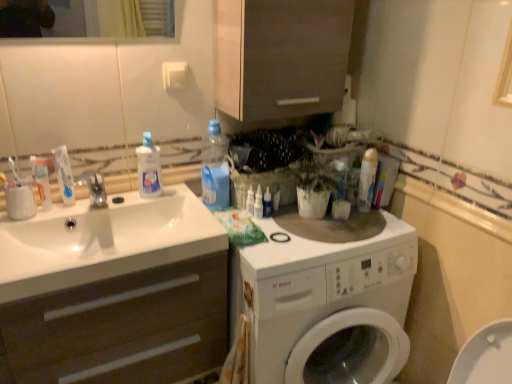
This screenshot has height=384, width=512. I want to click on vacant area located to the right-hand side of white glossy toothpaste at sink, the 2th toothpaste when ordered from right to left, so click(x=95, y=208).